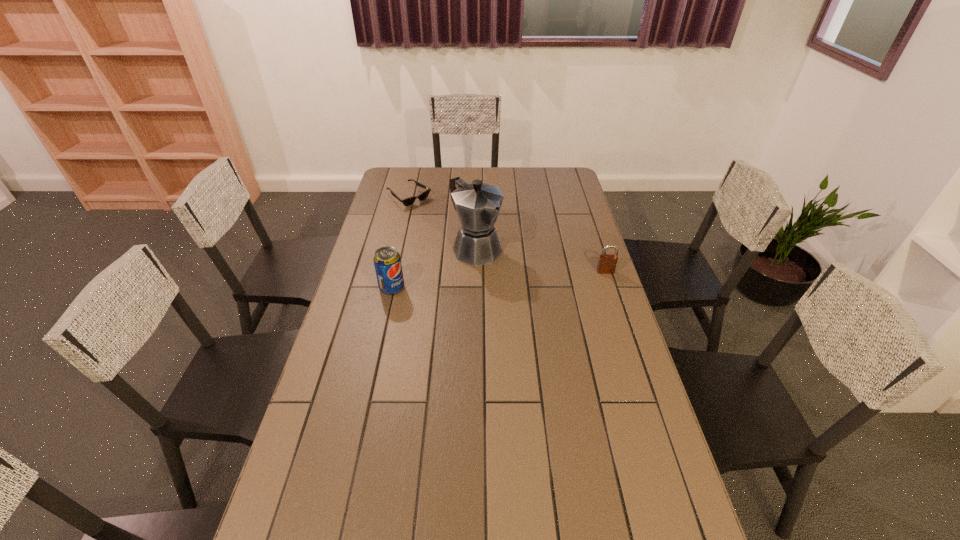
Locate an element on the screen. The image size is (960, 540). vacant space located 0.250m on the front-facing side of the sunglasses is located at coordinates (456, 232).

At what (x,y) coordinates should I click in order to perform the action: click on vacant space situated on the front-facing side of the sunglasses. Please return your answer as a coordinate pair (x, y). The width and height of the screenshot is (960, 540). Looking at the image, I should click on (475, 245).

Identify the location of vacant region located on the front-facing side of the sunglasses. (464, 237).

Where is `blank area located at the spout of the second farthest object`? blank area located at the spout of the second farthest object is located at coordinates (515, 279).

Locate an element on the screen. free space located 0.380m at the spout of the second farthest object is located at coordinates (567, 320).

Identify the location of free spot located at the spout of the second farthest object. This screenshot has width=960, height=540. (555, 309).

Find the location of a particular element. The image size is (960, 540). object positioned at the far edge is located at coordinates coord(408,201).

I want to click on soda that is positioned at the left edge, so click(x=387, y=261).

Locate an element on the screen. The image size is (960, 540). sunglasses located at the left edge is located at coordinates (408, 201).

Locate an element on the screen. object that is at the right edge is located at coordinates (607, 263).